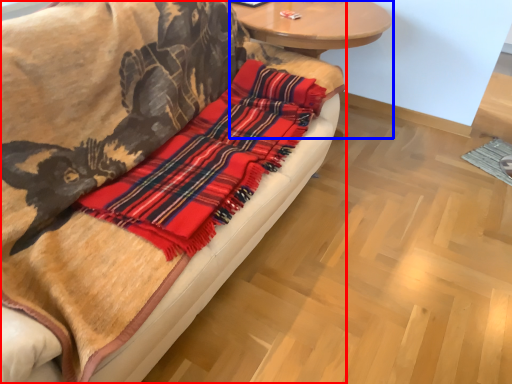
Question: Which object is closer to the camera taking this photo, studio couch (highlighted by a red box) or round table (highlighted by a blue box)?

Choices:
 (A) studio couch
 (B) round table

Answer: (A)